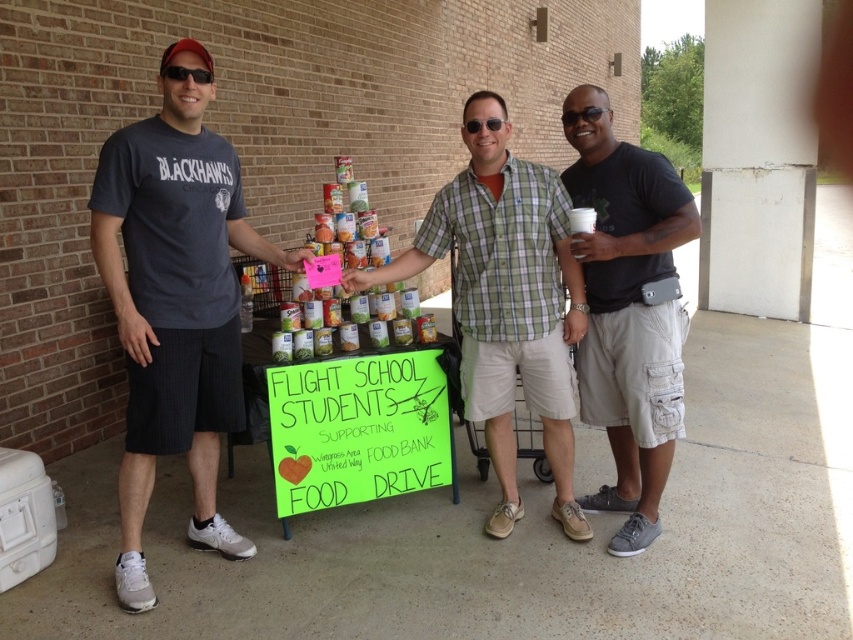
What do you see at coordinates (175, 301) in the screenshot? I see `dark gray t-shirt at left` at bounding box center [175, 301].

Between point (141, 228) and point (491, 458), which one is positioned in front?

Point (141, 228) is in front.

Which is behind, point (125, 147) or point (526, 301)?

Point (526, 301)

Locate an element on the screen. dark gray t-shirt at left is located at coordinates (175, 301).

Is green plaid shirt at center thinner than black cotton t-shirt at center?

No, green plaid shirt at center is not thinner than black cotton t-shirt at center.

Which of these two, green plaid shirt at center or black cotton t-shirt at center, stands shorter?

green plaid shirt at center

Between point (489, 401) and point (654, 336), which one is positioned in front?

Positioned in front is point (654, 336).

Image resolution: width=853 pixels, height=640 pixels. In order to click on green plaid shirt at center in this screenshot , I will do `click(506, 300)`.

Is dark gray t-shirt at left thinner than black cotton t-shirt at center?

In fact, dark gray t-shirt at left might be wider than black cotton t-shirt at center.

Which of these two, dark gray t-shirt at left or black cotton t-shirt at center, stands taller?

With more height is dark gray t-shirt at left.

Which is behind, point (103, 180) or point (608, 400)?

The point (608, 400) is more distant.

Image resolution: width=853 pixels, height=640 pixels. What are the coordinates of `dark gray t-shirt at left` in the screenshot? It's located at (175, 301).